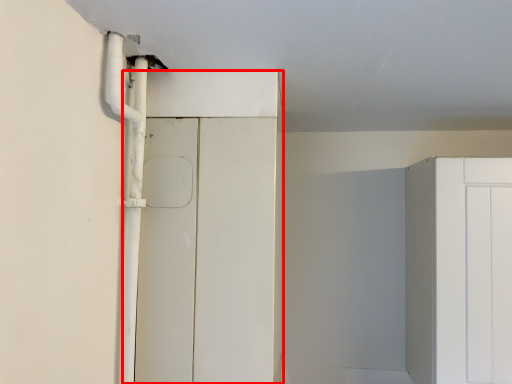
Question: From the image's perspective, considering the relative positions of door (annotated by the red box) and pipe in the image provided, where is door (annotated by the red box) located with respect to the staircase?

Choices:
 (A) above
 (B) below

Answer: (B)